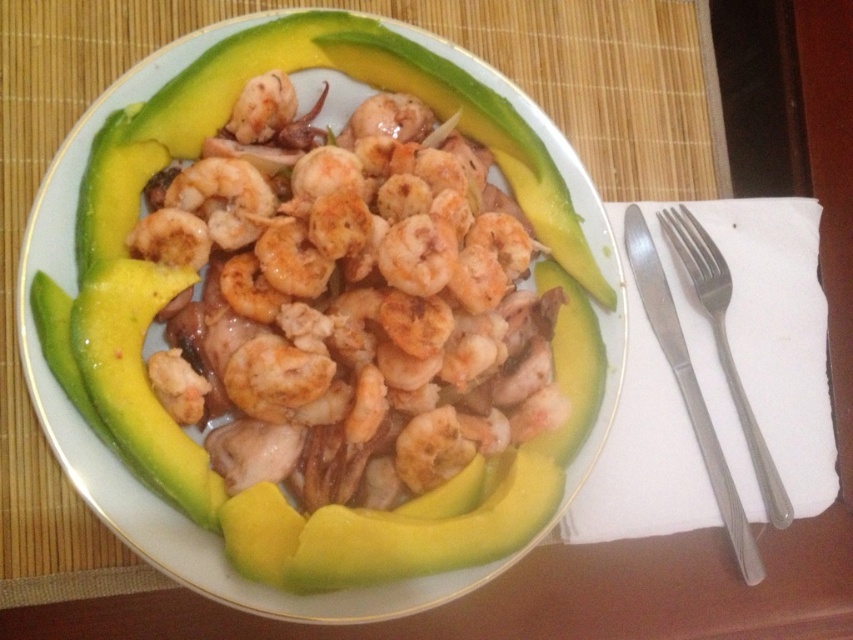
You are a diner at a restaurant and you want to pick up the shiny white plate at center with your right hand. Given that the satin silver fork at upper right is in your way, can you move the plate without moving the fork?

The shiny white plate at center is positioned on the left side of the satin silver fork at upper right. Since the plate is to the left of the fork, you can move the plate without disturbing the fork as they are arranged side by side.

You are a food critic at a restaurant. You see the shiny white plate at center and the satin silver fork at upper right on the table. Which one is placed closer to the edge of the table?

The satin silver fork at upper right is closer to the edge of the table because the shiny white plate at center is positioned over it, meaning the plate is closer to the center and the fork is further out.

You have a small sticker that is 10 cm wide. You want to place it on either the shiny white plate at center or the satin silver fork at upper right. Which object is wider and can fit the sticker?

The shiny white plate at center is wider than the satin silver fork at upper right, so the sticker can fit on the shiny white plate at center.